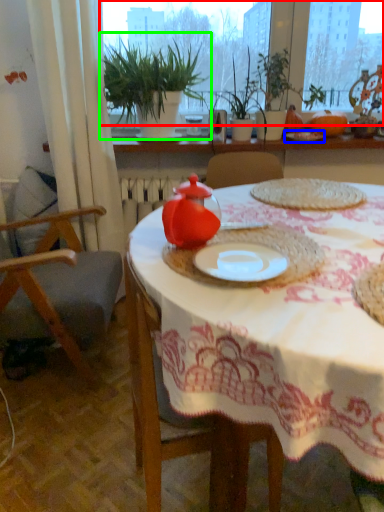
Question: Based on their relative distances, which object is farther from window screen (highlighted by a red box)? Choose from tableware (highlighted by a blue box) and houseplant (highlighted by a green box).

Choices:
 (A) tableware
 (B) houseplant

Answer: (A)